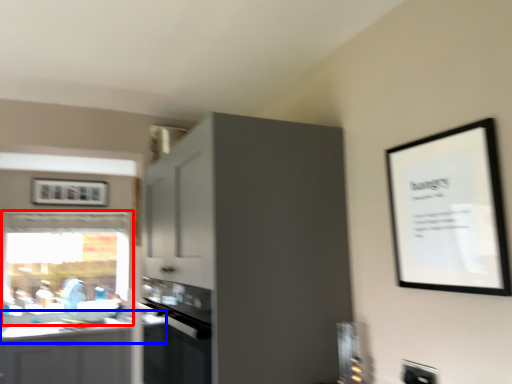
Question: Which point is closer to the camera, window (highlighted by a red box) or countertop (highlighted by a blue box)?

Choices:
 (A) window
 (B) countertop

Answer: (B)